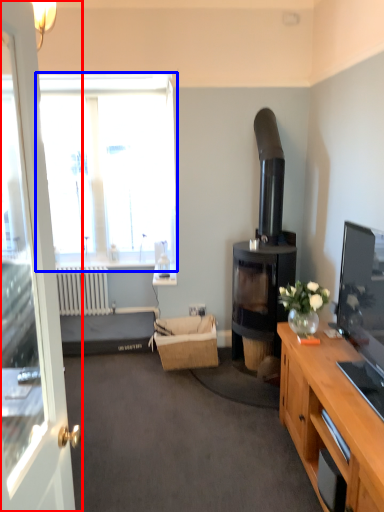
Question: Among these objects, which one is farthest to the camera, door (highlighted by a red box) or window (highlighted by a blue box)?

Choices:
 (A) door
 (B) window

Answer: (B)